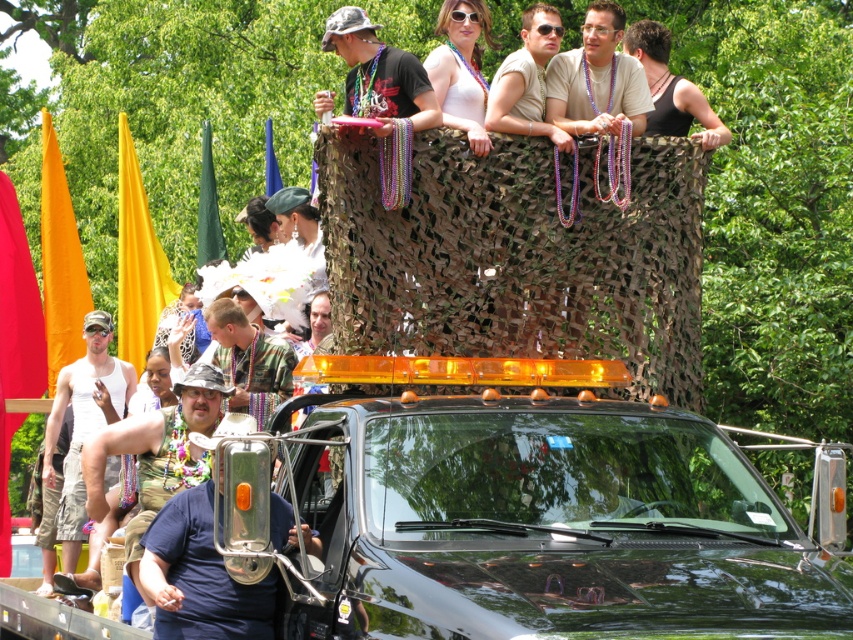
Question: Which object is closer to the camera taking this photo?

Choices:
 (A) white matte tank top at center
 (B) tan fabric at upper center
 (C) brushed metal bell at center

Answer: (C)

Question: Does white matte tank top at center appear on the left side of matte black sunglasses at upper center?

Choices:
 (A) no
 (B) yes

Answer: (B)

Question: Where is matte black sunglasses at upper center located in relation to matte black t-shirt at upper center in the image?

Choices:
 (A) right
 (B) left

Answer: (A)

Question: Is matte black sunglasses at upper center smaller than tan fabric at upper center?

Choices:
 (A) no
 (B) yes

Answer: (B)

Question: Which point is closer to the camera taking this photo?

Choices:
 (A) (62, 552)
 (B) (393, 104)
 (C) (192, 570)

Answer: (C)

Question: Which point is farther to the camera?

Choices:
 (A) white matte tank top at center
 (B) brushed metal bell at center
 (C) matte black t-shirt at upper center
 (D) tan fabric at upper center

Answer: (D)